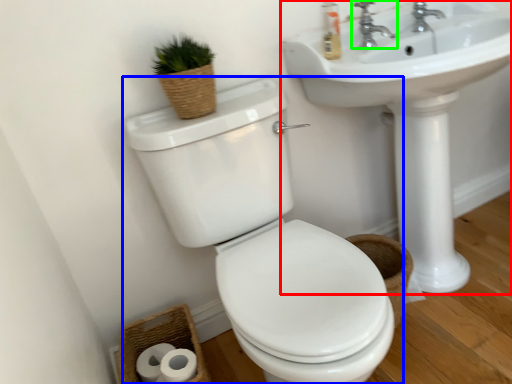
Question: Which object is the farthest from sink (highlighted by a red box)? Choose among these: toilet (highlighted by a blue box) or tap (highlighted by a green box).

Choices:
 (A) toilet
 (B) tap

Answer: (A)